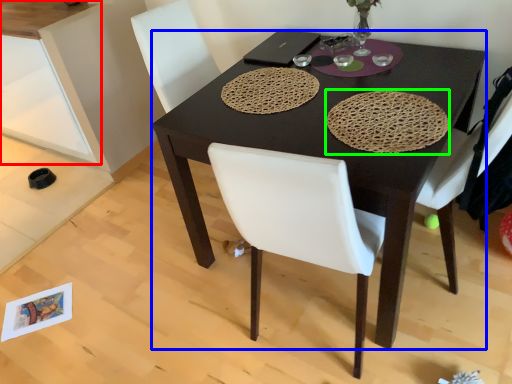
Question: Estimate the real-world distances between objects in this image. Which object is farther from cabinetry (highlighted by a red box), desk (highlighted by a blue box) or mat (highlighted by a green box)?

Choices:
 (A) desk
 (B) mat

Answer: (B)